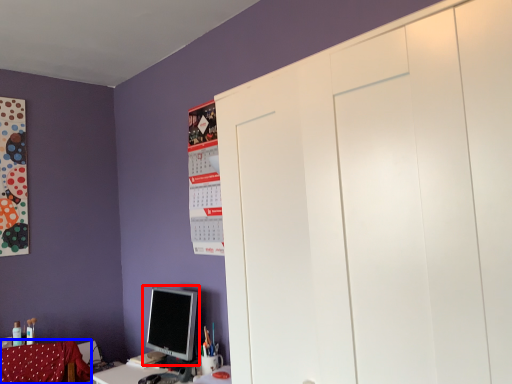
Question: Among these objects, which one is farthest to the camera, computer monitor (highlighted by a red box) or swivel chair (highlighted by a blue box)?

Choices:
 (A) computer monitor
 (B) swivel chair

Answer: (A)